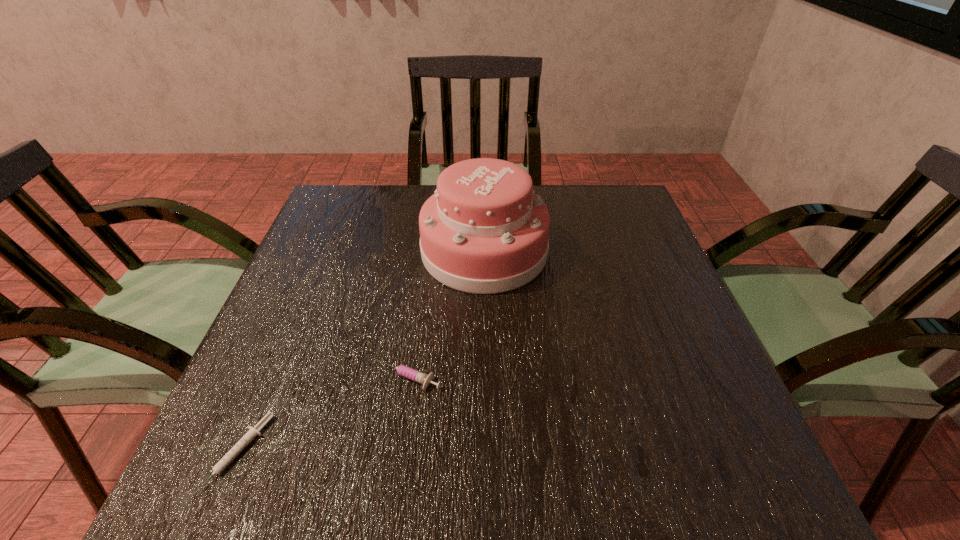
Image resolution: width=960 pixels, height=540 pixels. Find the location of `unoccupied position between the shorter syringe and the tallest object`. unoccupied position between the shorter syringe and the tallest object is located at coordinates (361, 353).

Image resolution: width=960 pixels, height=540 pixels. In order to click on free area in between the second shortest object and the farthest object in this screenshot , I will do pyautogui.click(x=445, y=314).

At what (x,y) coordinates should I click in order to perform the action: click on free spot between the left syringe and the second shortest object. Please return your answer as a coordinate pair (x, y). Image resolution: width=960 pixels, height=540 pixels. Looking at the image, I should click on (323, 415).

Image resolution: width=960 pixels, height=540 pixels. What are the coordinates of `blank region between the shortest object and the taller syringe` in the screenshot? It's located at (323, 415).

You are a GUI agent. You are given a task and a screenshot of the screen. Output one action in this format:
    pyautogui.click(x=<x>, y=<y>)
    Task: Click on the empty location between the second farthest object and the tallest object
    The height and width of the screenshot is (540, 960).
    Given the screenshot: What is the action you would take?
    pyautogui.click(x=445, y=314)

Identify the location of free space between the taller syringe and the nearer syringe. The height and width of the screenshot is (540, 960). (323, 415).

Where is `vacant region between the right syringe and the shortest object`? vacant region between the right syringe and the shortest object is located at coordinates (323, 415).

You are a GUI agent. You are given a task and a screenshot of the screen. Output one action in this format:
    pyautogui.click(x=<x>, y=<y>)
    Task: Click on the vacant area between the birthday cake and the nearest object
    This screenshot has height=540, width=960.
    Given the screenshot: What is the action you would take?
    pyautogui.click(x=361, y=353)

Locate an element on the screen. free spot between the shorter syringe and the tallest object is located at coordinates (361, 353).

Locate an element on the screen. This screenshot has width=960, height=540. object that is the closest to the second farthest object is located at coordinates (253, 431).